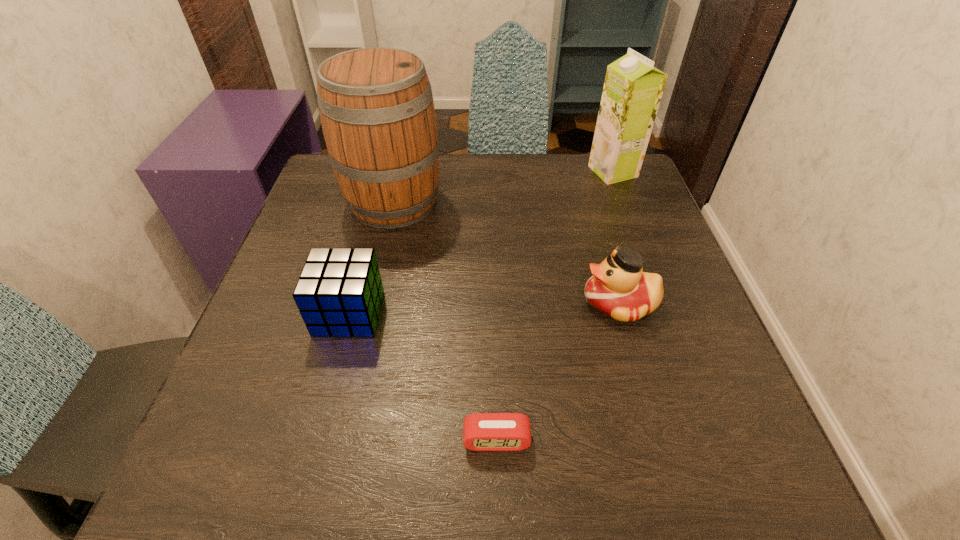
Identify the location of free space located on the face of the duck. (419, 303).

Image resolution: width=960 pixels, height=540 pixels. Identify the location of free location located on the right of the cube. (510, 313).

At what (x,y) coordinates should I click in order to perform the action: click on cider situated at the far edge. Please return your answer as a coordinate pair (x, y). Looking at the image, I should click on (376, 107).

This screenshot has height=540, width=960. In order to click on soya milk situated at the far edge in this screenshot , I will do 633,87.

The width and height of the screenshot is (960, 540). Find the location of `object present at the near edge`. object present at the near edge is located at coordinates (481, 431).

The height and width of the screenshot is (540, 960). Find the location of `cider that is positioned at the left edge`. cider that is positioned at the left edge is located at coordinates (376, 107).

The image size is (960, 540). What are the coordinates of `cube present at the left edge` in the screenshot? It's located at (339, 293).

The image size is (960, 540). In order to click on soya milk situated at the right edge in this screenshot , I will do `click(633, 87)`.

At what (x,y) coordinates should I click in order to perform the action: click on duck that is at the right edge. Please return your answer as a coordinate pair (x, y). Looking at the image, I should click on (619, 289).

Locate an element on the screen. object present at the far left corner is located at coordinates (376, 107).